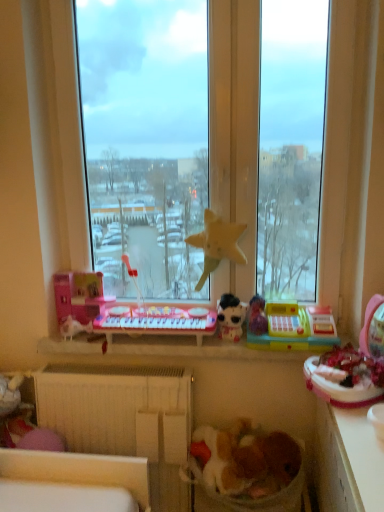
What do you see at coordinates (250, 469) in the screenshot? The height and width of the screenshot is (512, 384). I see `fluffy fabric laundry basket at lower center` at bounding box center [250, 469].

In order to face shiny pink plastic toy at center, should I rotate leftwards or rightwards?

Turn left by 4.419 degrees to look at shiny pink plastic toy at center.

The height and width of the screenshot is (512, 384). Describe the element at coordinates (217, 243) in the screenshot. I see `yellow fabric star at center, which is the third toy in right-to-left order` at that location.

Find the location of `pink plastic toy at left, which is the 1th toy from left to right`. pink plastic toy at left, which is the 1th toy from left to right is located at coordinates (78, 301).

Between white glossy counter top at lower right and transparent glass window at center, which one has smaller size?

transparent glass window at center.

Measure the distance from white glossy counter top at lower right to transparent glass window at center.

white glossy counter top at lower right and transparent glass window at center are 30.22 inches apart.

Do you think white glossy counter top at lower right is within transparent glass window at center, or outside of it?

white glossy counter top at lower right lies outside transparent glass window at center.

In the scene shown: Does white glossy counter top at lower right appear on the left side of transparent glass window at center?

In fact, white glossy counter top at lower right is to the right of transparent glass window at center.

How far apart are yellow plastic cash register at center, the first toy from the right, and pink plastic toy at left, which is the 1th toy from left to right?

A distance of 28.61 inches exists between yellow plastic cash register at center, the first toy from the right, and pink plastic toy at left, which is the 1th toy from left to right.

Is yellow plastic cash register at center, arranged as the fourth toy when viewed from the left, positioned far away from pink plastic toy at left, which is the 1th toy from left to right?

No, yellow plastic cash register at center, arranged as the fourth toy when viewed from the left, is not far away from pink plastic toy at left, which is the 1th toy from left to right.

Is yellow plastic cash register at center, arranged as the fourth toy when viewed from the left, closer to camera compared to pink plastic toy at left, which is the 1th toy from left to right?

Yes, yellow plastic cash register at center, arranged as the fourth toy when viewed from the left, is in front of pink plastic toy at left, which is the 1th toy from left to right.

Is yellow plastic cash register at center, the first toy from the right, looking in the opposite direction of pink plastic toy at left, which is the 1th toy from left to right?

No, yellow plastic cash register at center, the first toy from the right, is not facing the opposite direction of pink plastic toy at left, which is the 1th toy from left to right.

Is pink plastic toy at left, the fourth toy when ordered from right to left, looking in the opposite direction of white matte plush toy at center, which ranks as the second toy in right-to-left order?

No, pink plastic toy at left, the fourth toy when ordered from right to left, is not facing the opposite direction of white matte plush toy at center, which ranks as the second toy in right-to-left order.

Is pink plastic toy at left, the fourth toy when ordered from right to left, positioned before white matte plush toy at center, which ranks as the second toy in right-to-left order?

No, it is behind white matte plush toy at center, which ranks as the second toy in right-to-left order.

Does point (75, 282) lie behind point (238, 328)?

Yes, point (75, 282) is behind point (238, 328).

Is white matte radiator at lower center at the right side of white plush toy at lower left?

Correct, you'll find white matte radiator at lower center to the right of white plush toy at lower left.

Which object is further away from the camera, white matte radiator at lower center or white plush toy at lower left?

white plush toy at lower left is behind.

Locate an element on the screen. The height and width of the screenshot is (512, 384). radiator below the white plush toy at lower left (from the image's perspective) is located at coordinates (118, 409).

Choose the correct answer: Is white matte radiator at lower center inside white plush toy at lower left or outside it?

white matte radiator at lower center is located beyond the bounds of white plush toy at lower left.

Identify the location of laundry basket in front of the white matte radiator at lower center. (250, 469).

Does white matte radiator at lower center appear on the right side of fluffy fabric laundry basket at lower center?

In fact, white matte radiator at lower center is to the left of fluffy fabric laundry basket at lower center.

Considering the sizes of objects white matte radiator at lower center and fluffy fabric laundry basket at lower center in the image provided, who is bigger, white matte radiator at lower center or fluffy fabric laundry basket at lower center?

white matte radiator at lower center is bigger.

Does point (323, 414) come farther from viewer compared to point (63, 338)?

That is False.

From the image's perspective, which one is positioned higher, white glossy counter top at lower right or white plush toy at lower left?

From the image's view, white plush toy at lower left is above.

Is white glossy counter top at lower right oriented away from white plush toy at lower left?

white glossy counter top at lower right is not turned away from white plush toy at lower left.

Can white glossy counter top at lower right be found inside pink plastic toy at left, the fourth toy when ordered from right to left?

No, white glossy counter top at lower right is not a part of pink plastic toy at left, the fourth toy when ordered from right to left.

Does pink plastic toy at left, the fourth toy when ordered from right to left, appear on the left side of white glossy counter top at lower right?

Correct, you'll find pink plastic toy at left, the fourth toy when ordered from right to left, to the left of white glossy counter top at lower right.

From a real-world perspective, is pink plastic toy at left, the fourth toy when ordered from right to left, physically located above or below white glossy counter top at lower right?

pink plastic toy at left, the fourth toy when ordered from right to left, is situated higher than white glossy counter top at lower right in the real world.

Does point (76, 331) come closer to viewer compared to point (370, 487)?

No.

Identify the location of counter top on the right side of transparent glass window at center. The height and width of the screenshot is (512, 384). (347, 461).

This screenshot has width=384, height=512. Find the location of `the 3rd toy to the left when counting from the yellow plastic cash register at center, the first toy from the right`. the 3rd toy to the left when counting from the yellow plastic cash register at center, the first toy from the right is located at coordinates (78, 301).

From the image, which object appears to be farther from shiny pink plastic toy at center, white plastic toys at center or white matte radiator at lower center?

white matte radiator at lower center is further to shiny pink plastic toy at center.

From the image, which object appears to be nearer to pink plastic toy at left, the fourth toy when ordered from right to left, white matte plush toy at center, the 3th toy when ordered from left to right, or white matte radiator at lower center?

white matte radiator at lower center.

From the image, which object appears to be farther from white plush toy at lower left, shiny pink plastic toy at center or white matte plush toy at center, the 3th toy when ordered from left to right?

white matte plush toy at center, the 3th toy when ordered from left to right.

Which object lies nearer to the anchor point fluffy fabric laundry basket at lower center, shiny pink plastic toy at center or white plastic toys at center?

The object closer to fluffy fabric laundry basket at lower center is white plastic toys at center.

Considering their positions, is yellow plastic cash register at center, the first toy from the right, positioned closer to white matte plush toy at center, which ranks as the second toy in right-to-left order, than white glossy counter top at lower right?

The object closer to white matte plush toy at center, which ranks as the second toy in right-to-left order, is yellow plastic cash register at center, the first toy from the right.

Which object lies further to the anchor point yellow plastic cash register at center, arranged as the fourth toy when viewed from the left, shiny pink plastic toy at center or pink plastic toy at left, the fourth toy when ordered from right to left?

pink plastic toy at left, the fourth toy when ordered from right to left, is positioned further to the anchor yellow plastic cash register at center, arranged as the fourth toy when viewed from the left.

From the image, which object appears to be nearer to pink plastic toy at left, which is the 1th toy from left to right, yellow plastic cash register at center, arranged as the fourth toy when viewed from the left, or yellow fabric star at center, acting as the second toy starting from the left?

yellow fabric star at center, acting as the second toy starting from the left, lies closer to pink plastic toy at left, which is the 1th toy from left to right, than the other object.

Looking at the image, which one is located further to white plastic toys at center, yellow plastic cash register at center, arranged as the fourth toy when viewed from the left, or transparent glass window at center?

Among the two, transparent glass window at center is located further to white plastic toys at center.

Find the location of a particular element. This screenshot has height=512, width=384. laundry basket between white matte radiator at lower center and white glossy counter top at lower right from left to right is located at coordinates (250, 469).

Image resolution: width=384 pixels, height=512 pixels. Find the location of `counter top between yellow fabric star at center, acting as the second toy starting from the left, and fluffy fabric laundry basket at lower center, in the vertical direction`. counter top between yellow fabric star at center, acting as the second toy starting from the left, and fluffy fabric laundry basket at lower center, in the vertical direction is located at coordinates (347, 461).

Where is `window sill between white glossy counter top at lower right and shiny pink plastic toy at center from front to back`? This screenshot has height=512, width=384. window sill between white glossy counter top at lower right and shiny pink plastic toy at center from front to back is located at coordinates (211, 348).

You are a GUI agent. You are given a task and a screenshot of the screen. Output one action in this format:
    pyautogui.click(x=<x>, y=<y>)
    Task: Click on the window sill between white plush toy at lower left and yellow plastic cash register at center, the first toy from the right, from left to right
    
    Given the screenshot: What is the action you would take?
    pyautogui.click(x=211, y=348)